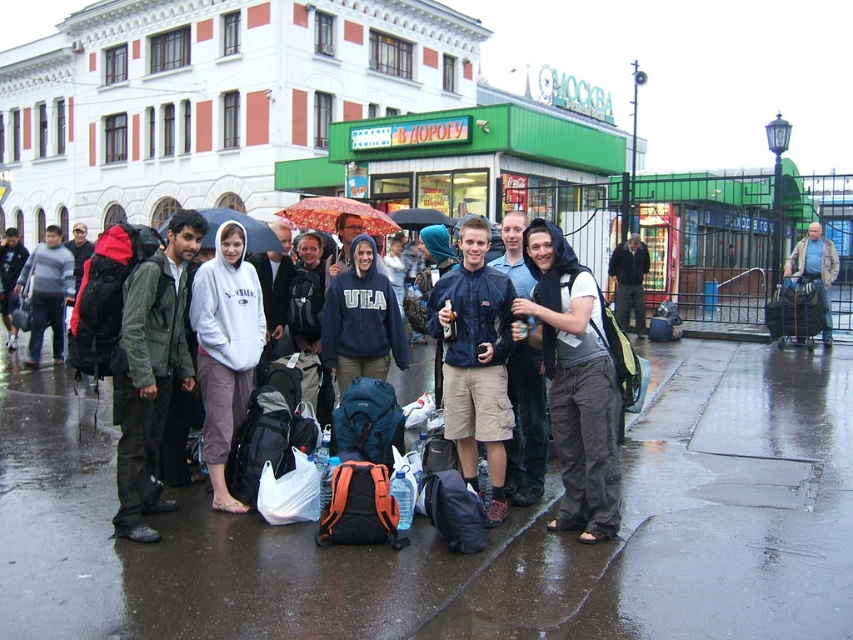
You are a traveler trying to keep your belongings dry during the rain. You have a matte black backpack at center and a red fabric umbrella at center. Which item should you prioritize keeping above the other to protect them from the rain?

The red fabric umbrella at center should be prioritized above the matte black backpack at center because umbrellas are designed to protect against rain, while backpacks can get wet without damage. However, since the matte black backpack at center is on the right side of the red fabric umbrella at center, positioning might affect coverage. To ensure both are protected, hold the red fabric umbrella at center so its coverage extends over both items, especially since the backpack is to the right, which might be

You are a traveler who just arrived at the station and see the matte black backpack at center and the red fabric umbrella at center. Which object is currently providing shelter from the rain?

The red fabric umbrella at center is providing shelter from the rain because the matte black backpack at center is positioned under it.

You are a photographer trying to capture a photo of the dark blue hoodie at center without the red fabric umbrella at center blocking it. Can you move to the left to avoid the umbrella? Explain why or why not based on their sizes.

The red fabric umbrella at center is wider than the dark blue hoodie at center. Moving to the left might still leave part of the umbrella in the frame since the umbrella is wider, so adjusting the angle or moving further away might be better options.